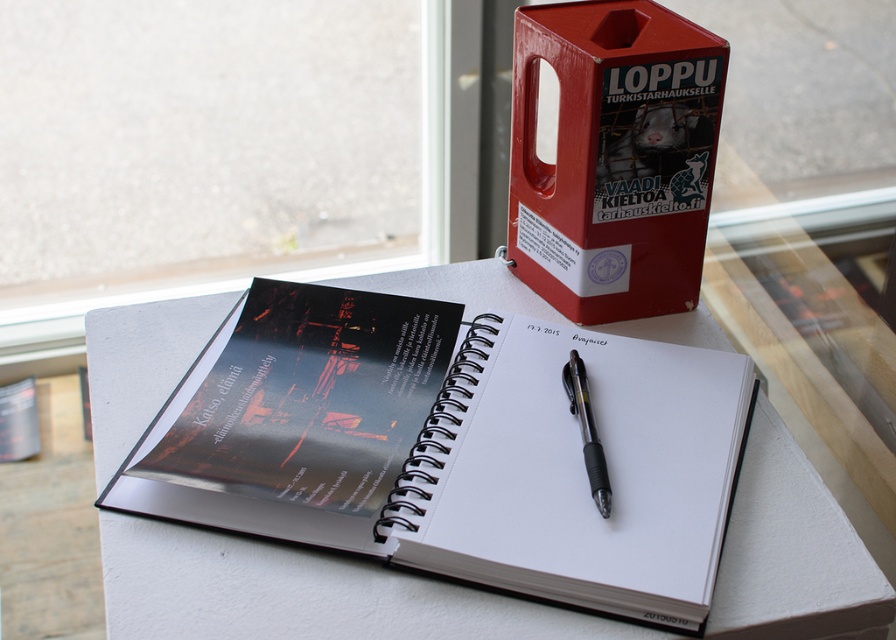
Looking at this image, between white paper notebook at center and transparent glass window at upper center, which one appears on the left side from the viewer's perspective?

transparent glass window at upper center is more to the left.

Between white paper notebook at center and transparent glass window at upper center, which one is positioned lower?

white paper notebook at center is below.

Identify the location of white paper notebook at center. Image resolution: width=896 pixels, height=640 pixels. (461, 451).

From the picture: Can you confirm if transparent glass window at upper center is taller than red plastic box at upper right?

Yes.

Between point (154, 282) and point (705, 116), which one is positioned in front?

Point (705, 116)

Describe the element at coordinates (205, 154) in the screenshot. The width and height of the screenshot is (896, 640). I see `transparent glass window at upper center` at that location.

This screenshot has height=640, width=896. I want to click on transparent glass window at upper center, so click(x=205, y=154).

Looking at this image, who is positioned more to the right, white paper notebook at center or black matte notebook at center?

From the viewer's perspective, white paper notebook at center appears more on the right side.

Who is more forward, (696, 540) or (138, 506)?

Point (696, 540)

Between point (388, 486) and point (208, 364), which one is positioned behind?

The point (208, 364) is behind.

The width and height of the screenshot is (896, 640). Find the location of `white paper notebook at center`. white paper notebook at center is located at coordinates (461, 451).